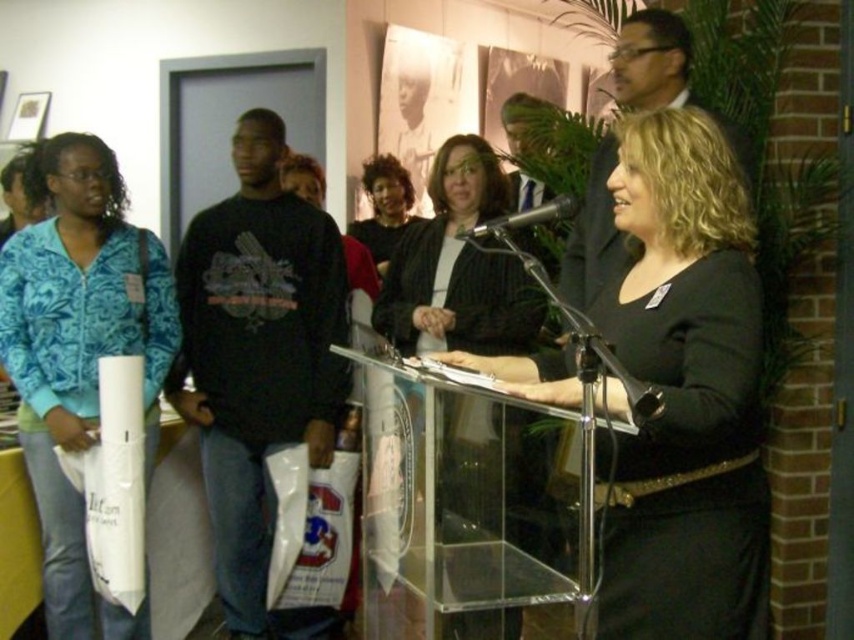
You are a photographer trying to capture a clear shot of both the matte black shirt at upper right and the matte black sweater at center. Since they are both dark, you want to ensure they are distinguishable in the photo. Which object should you focus on first to ensure it appears in the foreground?

The matte black shirt at upper right is positioned under the matte black sweater at center, so focusing on the matte black sweater at center first will ensure it stays in the foreground while the shirt remains slightly behind.

You are attending an event and notice a black cotton sweatshirt at left. Where exactly is it positioned in the room?

The black cotton sweatshirt at left is located at point 0.567 on the horizontal axis and 0.304 on the vertical axis.

You are a photographer at the event and want to capture a photo where both the matte black shirt at upper right and the metallic silver microphone at center are visible. Considering their heights, which object should you focus on to ensure both are in frame?

Answer: The matte black shirt at upper right is taller than the metallic silver microphone at center, so focusing on the matte black shirt at upper right will ensure both are in frame as it is the taller object.